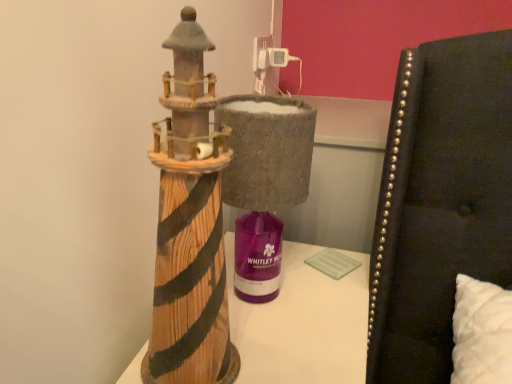
Find the location of a particular element. The height and width of the screenshot is (384, 512). empty space that is ontop of wooden table at center (from a real-world perspective) is located at coordinates tap(300, 299).